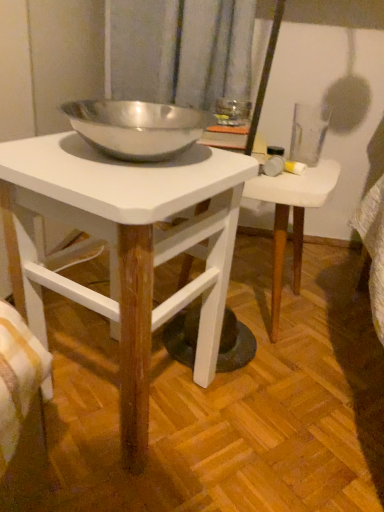
The image size is (384, 512). I want to click on vacant area on top of white wood table at center, positioned as the second table in front-to-back order (from a real-world perspective), so click(x=301, y=175).